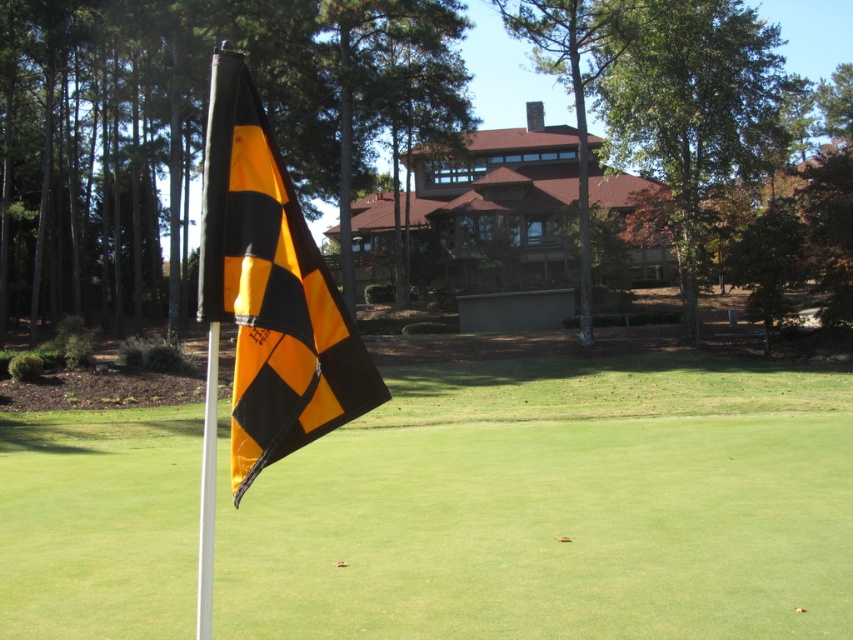
You are a golfer trying to determine the direction of the hole. You see the matte plastic flag at center and the white metallic pole at center. Which object is wider from your perspective?

The white metallic pole at center is wider than the matte plastic flag at center because the flag occupies less space than the pole.